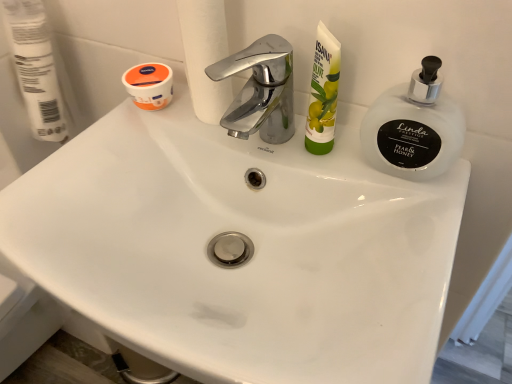
Question: Is frosted glass soap dispenser at upper right a part of green matte tube at upper right?

Choices:
 (A) no
 (B) yes

Answer: (A)

Question: Does green matte tube at upper right have a lesser height compared to frosted glass soap dispenser at upper right?

Choices:
 (A) yes
 (B) no

Answer: (B)

Question: From the image's perspective, does green matte tube at upper right appear lower than frosted glass soap dispenser at upper right?

Choices:
 (A) no
 (B) yes

Answer: (A)

Question: Is green matte tube at upper right far away from frosted glass soap dispenser at upper right?

Choices:
 (A) yes
 (B) no

Answer: (B)

Question: Does green matte tube at upper right have a greater width compared to frosted glass soap dispenser at upper right?

Choices:
 (A) no
 (B) yes

Answer: (A)

Question: Does green matte tube at upper right have a greater height compared to frosted glass soap dispenser at upper right?

Choices:
 (A) no
 (B) yes

Answer: (B)

Question: Can you see frosted glass soap dispenser at upper right touching white matte toilet paper at upper left, placed as the 2th toilet paper when sorted from right to left?

Choices:
 (A) yes
 (B) no

Answer: (B)

Question: Are frosted glass soap dispenser at upper right and white matte toilet paper at upper left, which is counted as the first toilet paper, starting from the left, far apart?

Choices:
 (A) no
 (B) yes

Answer: (A)

Question: Can you confirm if frosted glass soap dispenser at upper right is positioned to the left of white matte toilet paper at upper left, which is counted as the first toilet paper, starting from the left?

Choices:
 (A) no
 (B) yes

Answer: (A)

Question: Is frosted glass soap dispenser at upper right facing away from white matte toilet paper at upper left, which is counted as the first toilet paper, starting from the left?

Choices:
 (A) yes
 (B) no

Answer: (B)

Question: From a real-world perspective, is frosted glass soap dispenser at upper right on white matte toilet paper at upper left, placed as the 2th toilet paper when sorted from right to left?

Choices:
 (A) no
 (B) yes

Answer: (A)

Question: Can you confirm if frosted glass soap dispenser at upper right is positioned to the right of white matte toilet paper at upper left, which is counted as the first toilet paper, starting from the left?

Choices:
 (A) no
 (B) yes

Answer: (B)

Question: From a real-world perspective, is white matte toilet paper at upper left, placed as the 2th toilet paper when sorted from right to left, positioned over white matte toilet paper at upper center, which ranks as the 1th toilet paper in right-to-left order, based on gravity?

Choices:
 (A) no
 (B) yes

Answer: (A)